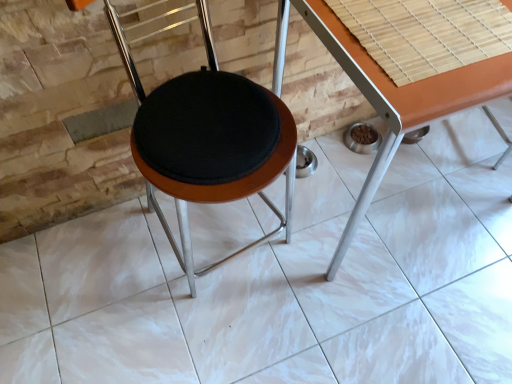
The width and height of the screenshot is (512, 384). I want to click on vacant space in front of orange laminate table at center, so click(395, 319).